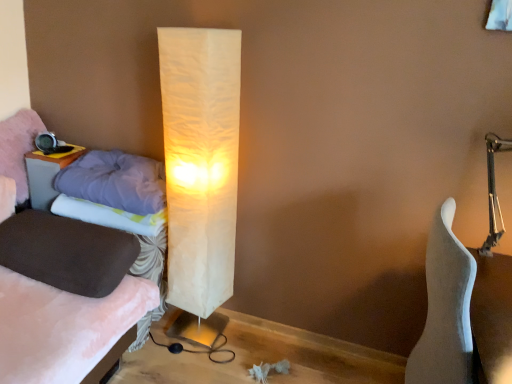
What do you see at coordinates (46, 175) in the screenshot? This screenshot has width=512, height=384. I see `matte wood table at left` at bounding box center [46, 175].

This screenshot has height=384, width=512. What are the coordinates of `white paper lamp at center` in the screenshot? It's located at (200, 162).

This screenshot has width=512, height=384. Describe the element at coordinates (18, 148) in the screenshot. I see `velvet purple pillow at left, the fourth pillow positioned from the bottom` at that location.

Describe the element at coordinates (445, 308) in the screenshot. I see `white matte guitar at right` at that location.

What do you see at coordinates (115, 181) in the screenshot? I see `fluffy purple pillow at left, which is the 3th pillow in bottom-to-top order` at bounding box center [115, 181].

Where is `matte wood table at left`? The width and height of the screenshot is (512, 384). matte wood table at left is located at coordinates pos(46,175).

From the image's perspective, is velvet purple pillow at left, the 1th pillow viewed from the top, located above or below velvet brown bed at left?

velvet purple pillow at left, the 1th pillow viewed from the top, is situated higher than velvet brown bed at left in the image.

Can you tell me how much velvet purple pillow at left, the 1th pillow viewed from the top, and velvet brown bed at left differ in facing direction?

The facing directions of velvet purple pillow at left, the 1th pillow viewed from the top, and velvet brown bed at left are 90.3 degrees apart.

Is velvet purple pillow at left, the 1th pillow viewed from the top, not inside velvet brown bed at left?

Yes, velvet purple pillow at left, the 1th pillow viewed from the top, is outside of velvet brown bed at left.

Is point (2, 127) closer or farther from the camera than point (40, 351)?

Point (2, 127) is farther from the camera than point (40, 351).

From a real-world perspective, is fluffy purple pillow at left, which is the 3th pillow in bottom-to-top order, physically above suede-like brown pillow at left, which appears as the 1th pillow when ordered from the bottom?

Indeed, from a real-world perspective, fluffy purple pillow at left, which is the 3th pillow in bottom-to-top order, stands above suede-like brown pillow at left, which appears as the 1th pillow when ordered from the bottom.

Between fluffy purple pillow at left, which is the 3th pillow in bottom-to-top order, and suede-like brown pillow at left, which appears as the 1th pillow when ordered from the bottom, which one appears on the right side from the viewer's perspective?

From the viewer's perspective, fluffy purple pillow at left, which is the 3th pillow in bottom-to-top order, appears more on the right side.

From the image's perspective, between fluffy purple pillow at left, acting as the 2th pillow starting from the top, and suede-like brown pillow at left, arranged as the 4th pillow when viewed from the top, which one is located above?

fluffy purple pillow at left, acting as the 2th pillow starting from the top, from the image's perspective.

What's the angular difference between fluffy purple pillow at left, acting as the 2th pillow starting from the top, and suede-like brown pillow at left, arranged as the 4th pillow when viewed from the top,'s facing directions?

The facing directions of fluffy purple pillow at left, acting as the 2th pillow starting from the top, and suede-like brown pillow at left, arranged as the 4th pillow when viewed from the top, are 90.3 degrees apart.

Which object is more forward, white fabric pillow at left, the third pillow positioned from the top, or velvet brown bed at left?

velvet brown bed at left.

Can you confirm if white fabric pillow at left, which is the 2th pillow from bottom to top, is smaller than velvet brown bed at left?

Correct, white fabric pillow at left, which is the 2th pillow from bottom to top, occupies less space than velvet brown bed at left.

Looking at this image, measure the distance between white fabric pillow at left, the third pillow positioned from the top, and velvet brown bed at left.

They are 15.07 inches apart.

Is white fabric pillow at left, which is the 2th pillow from bottom to top, aimed at velvet brown bed at left?

Yes, white fabric pillow at left, which is the 2th pillow from bottom to top, faces towards velvet brown bed at left.

I want to click on lamp in front of the fluffy purple pillow at left, acting as the 2th pillow starting from the top, so click(x=200, y=162).

Is fluffy purple pillow at left, acting as the 2th pillow starting from the top, aimed at white paper lamp at center?

No, fluffy purple pillow at left, acting as the 2th pillow starting from the top, does not turn towards white paper lamp at center.

Can you confirm if fluffy purple pillow at left, acting as the 2th pillow starting from the top, is bigger than white paper lamp at center?

No.

Is the surface of velvet brown bed at left in direct contact with white matte guitar at right?

No, velvet brown bed at left is not beside white matte guitar at right.

Consider the image. Is velvet brown bed at left surrounding white matte guitar at right?

Actually, white matte guitar at right is outside velvet brown bed at left.

Considering the positions of objects velvet brown bed at left and white matte guitar at right in the image provided, who is more to the right, velvet brown bed at left or white matte guitar at right?

From the viewer's perspective, white matte guitar at right appears more on the right side.

Considering the sizes of velvet brown bed at left and white matte guitar at right in the image, is velvet brown bed at left bigger or smaller than white matte guitar at right?

velvet brown bed at left is bigger than white matte guitar at right.

Is velvet brown bed at left at the right side of velvet purple pillow at left, the 1th pillow viewed from the top?

Yes, velvet brown bed at left is to the right of velvet purple pillow at left, the 1th pillow viewed from the top.

Is velvet brown bed at left wider or thinner than velvet purple pillow at left, the fourth pillow positioned from the bottom?

Clearly, velvet brown bed at left has more width compared to velvet purple pillow at left, the fourth pillow positioned from the bottom.

From a real-world perspective, does velvet brown bed at left sit lower than velvet purple pillow at left, the fourth pillow positioned from the bottom?

Indeed, from a real-world perspective, velvet brown bed at left is positioned beneath velvet purple pillow at left, the fourth pillow positioned from the bottom.

Is velvet brown bed at left not near velvet purple pillow at left, the 1th pillow viewed from the top?

That's not correct — velvet brown bed at left is a little close to velvet purple pillow at left, the 1th pillow viewed from the top.

Considering the sizes of objects white matte guitar at right and white fabric pillow at left, which is the 2th pillow from bottom to top, in the image provided, who is wider, white matte guitar at right or white fabric pillow at left, which is the 2th pillow from bottom to top,?

Wider between the two is white matte guitar at right.

From a real-world perspective, is white matte guitar at right positioned under white fabric pillow at left, which is the 2th pillow from bottom to top, based on gravity?

Yes, from a real-world perspective, white matte guitar at right is beneath white fabric pillow at left, which is the 2th pillow from bottom to top.

You are a GUI agent. You are given a task and a screenshot of the screen. Output one action in this format:
    pyautogui.click(x=<x>, y=<y>)
    Task: Click on the pillow that is the 2nd one above the white matte guitar at right (from a real-world perspective)
    
    Given the screenshot: What is the action you would take?
    pyautogui.click(x=109, y=216)

Locate an element on the screen. This screenshot has width=512, height=384. bed below the velvet purple pillow at left, the fourth pillow positioned from the bottom (from the image's perspective) is located at coordinates (63, 328).

Which pillow is the 1st one when counting from the back of the suede-like brown pillow at left, arranged as the 4th pillow when viewed from the top? Please provide its 2D coordinates.

[(115, 181)]

In the scene shown: Based on their spatial positions, is white fabric pillow at left, the third pillow positioned from the top, or white paper lamp at center further from velvet brown bed at left?

white paper lamp at center is further to velvet brown bed at left.

From the image, which object appears to be farther from velvet purple pillow at left, the 1th pillow viewed from the top, velvet brown bed at left or matte wood table at left?

The object further to velvet purple pillow at left, the 1th pillow viewed from the top, is velvet brown bed at left.

From the picture: When comparing their distances from velvet brown bed at left, does white fabric pillow at left, which is the 2th pillow from bottom to top, or matte wood table at left seem further?

matte wood table at left is further to velvet brown bed at left.

From the image, which object appears to be farther from velvet brown bed at left, suede-like brown pillow at left, which appears as the 1th pillow when ordered from the bottom, or fluffy purple pillow at left, which is the 3th pillow in bottom-to-top order?

fluffy purple pillow at left, which is the 3th pillow in bottom-to-top order, lies further to velvet brown bed at left than the other object.

Which object lies further to the anchor point fluffy purple pillow at left, which is the 3th pillow in bottom-to-top order, white matte guitar at right or velvet brown bed at left?

white matte guitar at right.

Considering their positions, is white fabric pillow at left, which is the 2th pillow from bottom to top, positioned further to fluffy purple pillow at left, which is the 3th pillow in bottom-to-top order, than velvet brown bed at left?

The object further to fluffy purple pillow at left, which is the 3th pillow in bottom-to-top order, is velvet brown bed at left.

Estimate the real-world distances between objects in this image. Which object is closer to white matte guitar at right, velvet purple pillow at left, the 1th pillow viewed from the top, or fluffy purple pillow at left, which is the 3th pillow in bottom-to-top order?

Based on the image, fluffy purple pillow at left, which is the 3th pillow in bottom-to-top order, appears to be nearer to white matte guitar at right.

Which object lies nearer to the anchor point white paper lamp at center, suede-like brown pillow at left, arranged as the 4th pillow when viewed from the top, or velvet brown bed at left?

The object closer to white paper lamp at center is suede-like brown pillow at left, arranged as the 4th pillow when viewed from the top.

You are a GUI agent. You are given a task and a screenshot of the screen. Output one action in this format:
    pyautogui.click(x=<x>, y=<y>)
    Task: Click on the pillow situated between white fabric pillow at left, which is the 2th pillow from bottom to top, and white matte guitar at right from left to right
    The image size is (512, 384).
    Given the screenshot: What is the action you would take?
    pyautogui.click(x=115, y=181)

Identify the location of lamp between fluffy purple pillow at left, acting as the 2th pillow starting from the top, and white matte guitar at right, in the horizontal direction. 200,162.

Locate an element on the screen. This screenshot has width=512, height=384. lamp situated between velvet brown bed at left and white matte guitar at right from left to right is located at coordinates click(x=200, y=162).

You are a GUI agent. You are given a task and a screenshot of the screen. Output one action in this format:
    pyautogui.click(x=<x>, y=<y>)
    Task: Click on the lamp located between matte wood table at left and white matte guitar at right in the left-right direction
    The image size is (512, 384).
    Given the screenshot: What is the action you would take?
    pyautogui.click(x=200, y=162)